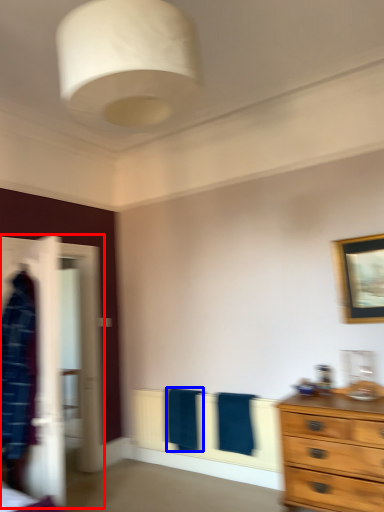
Question: Which of the following is the closest to the observer, closet (highlighted by a red box) or bath towel (highlighted by a blue box)?

Choices:
 (A) closet
 (B) bath towel

Answer: (A)